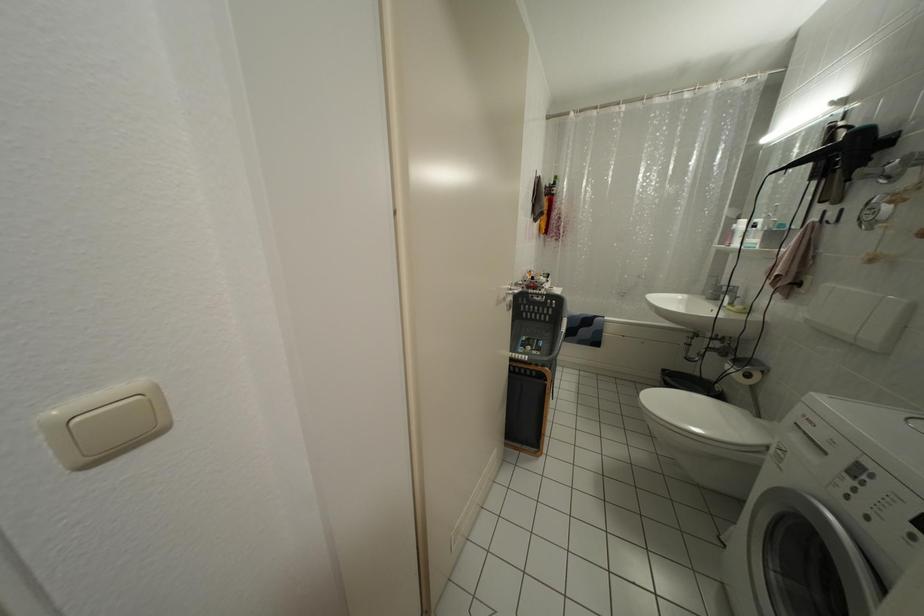
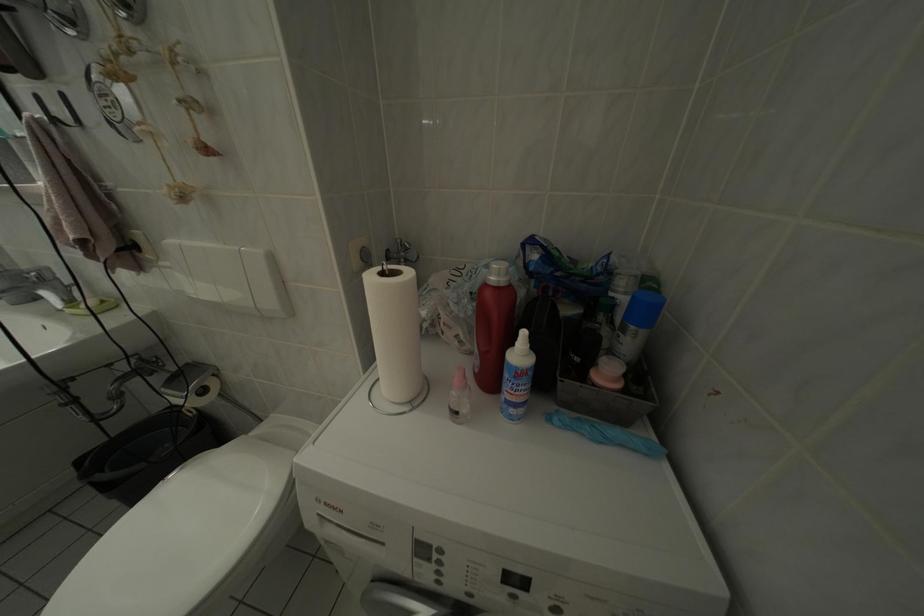
How did the camera likely rotate?

The camera's rotation is toward right-down.